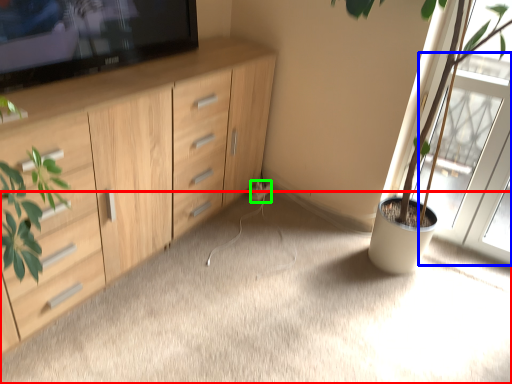
Question: Which object is the closest to the plain (highlighted by a red box)? Choose among these: screen door (highlighted by a blue box) or electric outlet (highlighted by a green box).

Choices:
 (A) screen door
 (B) electric outlet

Answer: (A)